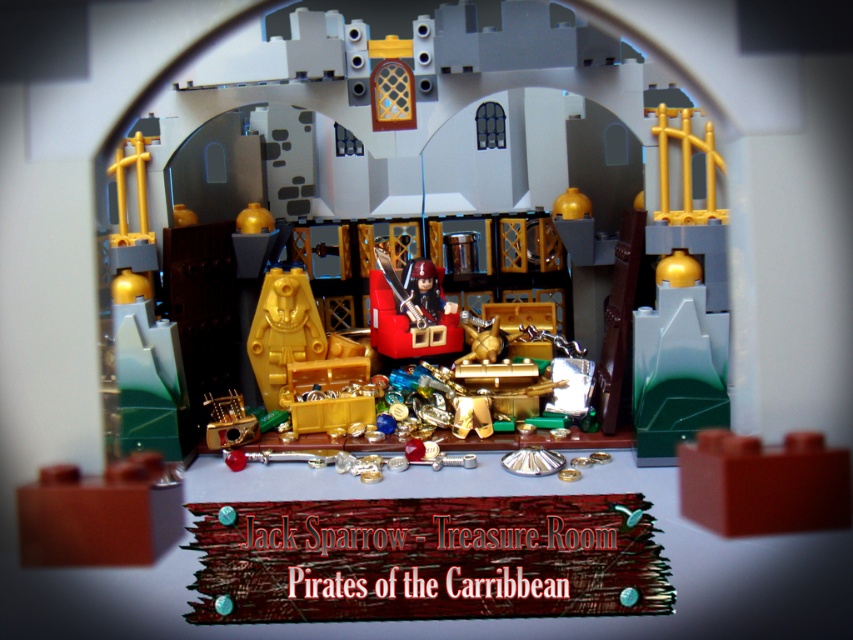
Question: Which point is closer to the camera?

Choices:
 (A) (457, 342)
 (B) (251, 349)

Answer: (B)

Question: Among these points, which one is farthest from the camera?

Choices:
 (A) (283, 332)
 (B) (439, 268)

Answer: (B)

Question: Which point is closer to the camera?

Choices:
 (A) (309, 298)
 (B) (445, 308)

Answer: (A)

Question: Does matte black pirate ship at center appear on the right side of matte gold treasure chest at center?

Choices:
 (A) yes
 (B) no

Answer: (A)

Question: Does matte black pirate ship at center appear on the right side of matte gold treasure chest at center?

Choices:
 (A) no
 (B) yes

Answer: (B)

Question: Can you confirm if matte black pirate ship at center is wider than matte gold treasure chest at center?

Choices:
 (A) no
 (B) yes

Answer: (B)